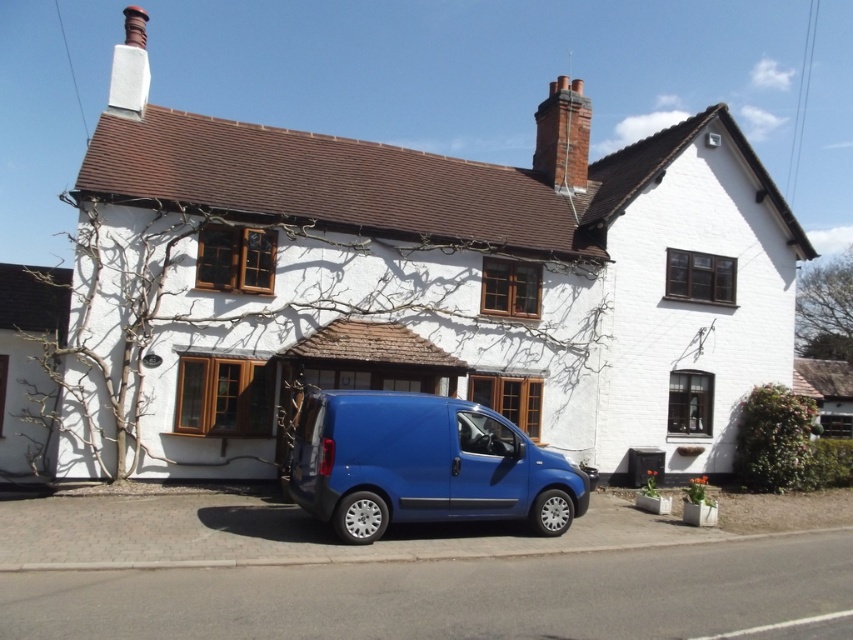
Is point (509, 253) positioned after point (415, 499)?

Yes, it is behind point (415, 499).

Is point (91, 209) closer to camera compared to point (474, 410)?

No, it is not.

Is point (131, 184) behind point (548, 509)?

That is True.

The width and height of the screenshot is (853, 640). Identify the location of white painted brick cottage at center. (410, 289).

Which is behind, point (231, 136) or point (25, 435)?

The point (231, 136) is more distant.

Is white painted brick cottage at center thinner than white painted wood at left?

In fact, white painted brick cottage at center might be wider than white painted wood at left.

At what (x,y) coordinates should I click in order to perform the action: click on white painted brick cottage at center. Please return your answer as a coordinate pair (x, y). This screenshot has width=853, height=640. Looking at the image, I should click on (410, 289).

Can you confirm if white painted brick cottage at center is bigger than red brick chimney at upper right?

Incorrect, white painted brick cottage at center is not larger than red brick chimney at upper right.

Can you confirm if white painted brick cottage at center is smaller than red brick chimney at upper right?

Indeed, white painted brick cottage at center has a smaller size compared to red brick chimney at upper right.

Who is more distant from viewer, [666,173] or [550,125]?

Positioned behind is point [550,125].

Where is `white painted brick cottage at center`? This screenshot has width=853, height=640. white painted brick cottage at center is located at coordinates [x=410, y=289].